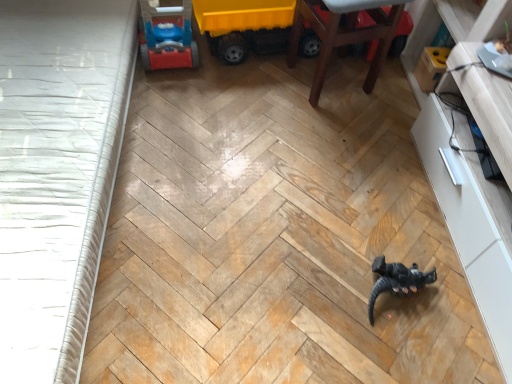
Locate an element on the screen. The width and height of the screenshot is (512, 384). vacant space in between yellow plastic toy truck at upper center, which appears as the second toy when viewed from the front, and black matte dinosaur at center, the first toy positioned from the bottom is located at coordinates (311, 155).